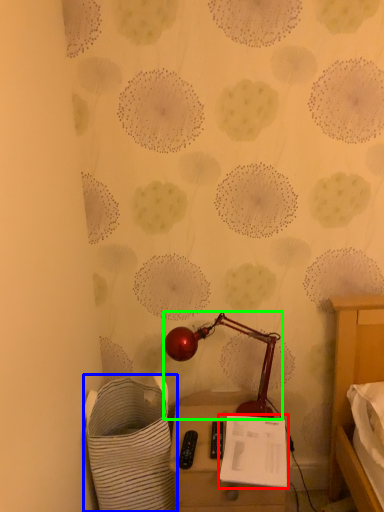
Question: Which object is positioned farthest from notepad (highlighted by a red box)? Select from laundry basket (highlighted by a blue box) and lamp (highlighted by a green box).

Choices:
 (A) laundry basket
 (B) lamp

Answer: (A)